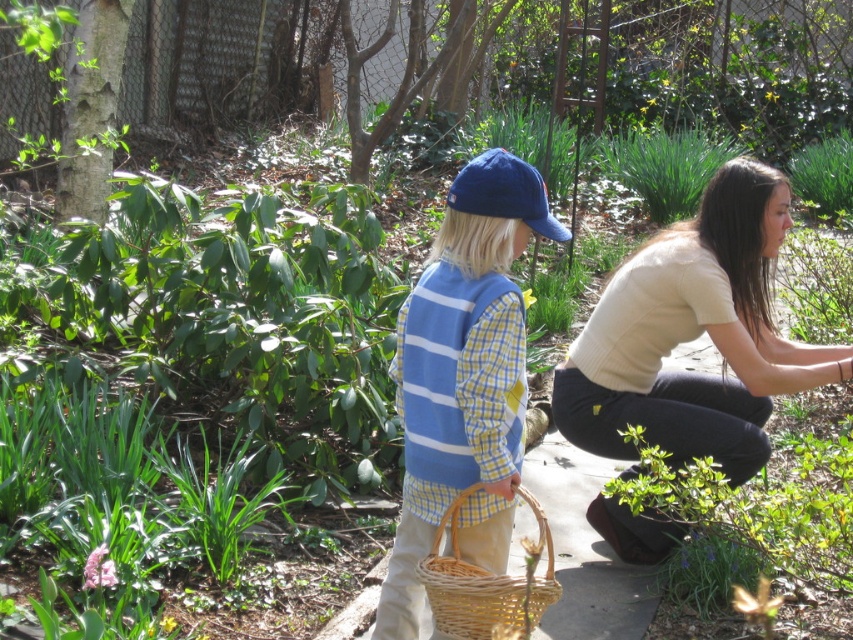
Question: Is light beige sweater at lower right to the right of blue cotton cap at center from the viewer's perspective?

Choices:
 (A) yes
 (B) no

Answer: (A)

Question: Which point is closer to the camera taking this photo?

Choices:
 (A) (492, 625)
 (B) (408, 461)

Answer: (A)

Question: Which object is the farthest from the light beige sweater at lower right?

Choices:
 (A) woven natural basket at lower center
 (B) blue cotton cap at center

Answer: (A)

Question: Which point is closer to the camera taking this photo?

Choices:
 (A) (492, 625)
 (B) (612, 531)
 (C) (389, 612)

Answer: (A)

Question: Is blue cotton cap at center bigger than woven natural basket at lower center?

Choices:
 (A) no
 (B) yes

Answer: (B)

Question: Can you confirm if light beige sweater at lower right is positioned below woven natural basket at lower center?

Choices:
 (A) no
 (B) yes

Answer: (A)